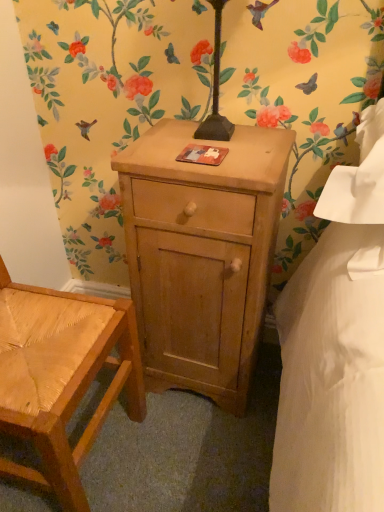
Locate an element on the screen. natural wood nightstand at center is located at coordinates (201, 254).

The width and height of the screenshot is (384, 512). What do you see at coordinates (201, 254) in the screenshot? I see `natural wood nightstand at center` at bounding box center [201, 254].

The height and width of the screenshot is (512, 384). What do you see at coordinates (61, 376) in the screenshot? I see `woven wood chair at lower left` at bounding box center [61, 376].

Locate an element on the screen. The width and height of the screenshot is (384, 512). woven wood chair at lower left is located at coordinates (61, 376).

Locate an element on the screen. Image resolution: width=384 pixels, height=512 pixels. natural wood nightstand at center is located at coordinates (201, 254).

Which object is positioned more to the right, natural wood nightstand at center or woven wood chair at lower left?

natural wood nightstand at center is more to the right.

Is natural wood nightstand at center closer to camera compared to woven wood chair at lower left?

No, it is not.

Is point (246, 289) in front of point (79, 389)?

No, (246, 289) is behind (79, 389).

Looking at this image, from the image's perspective, is natural wood nightstand at center positioned above or below woven wood chair at lower left?

natural wood nightstand at center is above woven wood chair at lower left.

Based on the photo, from a real-world perspective, is natural wood nightstand at center physically below woven wood chair at lower left?

Yes.

Is natural wood nightstand at center wider or thinner than woven wood chair at lower left?

In the image, natural wood nightstand at center appears to be more narrow than woven wood chair at lower left.

From the picture: Between natural wood nightstand at center and woven wood chair at lower left, which one has more height?

woven wood chair at lower left.

Which of these two, natural wood nightstand at center or woven wood chair at lower left, is smaller?

natural wood nightstand at center is smaller.

Could woven wood chair at lower left be considered to be inside natural wood nightstand at center?

No, woven wood chair at lower left is not inside natural wood nightstand at center.

Can you see natural wood nightstand at center touching woven wood chair at lower left?

No, natural wood nightstand at center is not next to woven wood chair at lower left.

In the scene shown: Is natural wood nightstand at center facing away from woven wood chair at lower left?

natural wood nightstand at center is not turned away from woven wood chair at lower left.

How different are the orientations of natural wood nightstand at center and woven wood chair at lower left in degrees?

89.6 degrees.

How far apart are natural wood nightstand at center and woven wood chair at lower left?

natural wood nightstand at center and woven wood chair at lower left are 10.77 inches apart from each other.

Identify the location of nightstand below the woven wood chair at lower left (from a real-world perspective). The width and height of the screenshot is (384, 512). (201, 254).

Considering the positions of objects woven wood chair at lower left and natural wood nightstand at center in the image provided, who is more to the right, woven wood chair at lower left or natural wood nightstand at center?

natural wood nightstand at center is more to the right.

Considering the relative positions of woven wood chair at lower left and natural wood nightstand at center in the image provided, is woven wood chair at lower left in front of natural wood nightstand at center?

Yes, it is.

Between point (67, 308) and point (175, 380), which one is positioned in front?

Positioned in front is point (67, 308).

From the image's perspective, is woven wood chair at lower left located beneath natural wood nightstand at center?

Yes, from the image's perspective, woven wood chair at lower left is below natural wood nightstand at center.

From a real-world perspective, is woven wood chair at lower left on natural wood nightstand at center?

Yes, from a real-world perspective, woven wood chair at lower left is on top of natural wood nightstand at center.

Which of these two, woven wood chair at lower left or natural wood nightstand at center, is thinner?

natural wood nightstand at center is thinner.

Which of these two, woven wood chair at lower left or natural wood nightstand at center, stands shorter?

natural wood nightstand at center is shorter.

Is woven wood chair at lower left smaller than natural wood nightstand at center?

No.

Is woven wood chair at lower left completely or partially outside of natural wood nightstand at center?

Yes.

Is woven wood chair at lower left in contact with natural wood nightstand at center?

woven wood chair at lower left is not next to natural wood nightstand at center, and they're not touching.

Is woven wood chair at lower left facing towards natural wood nightstand at center?

No, woven wood chair at lower left does not turn towards natural wood nightstand at center.

How many degrees apart are the facing directions of woven wood chair at lower left and natural wood nightstand at center?

There is a 89.6-degree angle between the facing directions of woven wood chair at lower left and natural wood nightstand at center.

The width and height of the screenshot is (384, 512). I want to click on nightstand on the right side of woven wood chair at lower left, so click(x=201, y=254).

Identify the location of nightstand behind the woven wood chair at lower left. The image size is (384, 512). (201, 254).

The height and width of the screenshot is (512, 384). What are the coordinates of `chair above the natural wood nightstand at center (from a real-world perspective)` in the screenshot? It's located at (61, 376).